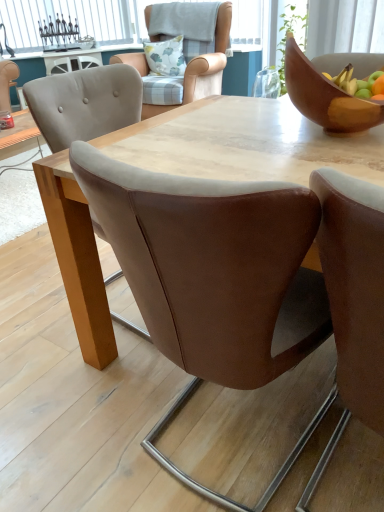
Locate an element on the screen. The height and width of the screenshot is (512, 384). vacant location below wooden bowl at upper right (from a real-world perspective) is located at coordinates (338, 136).